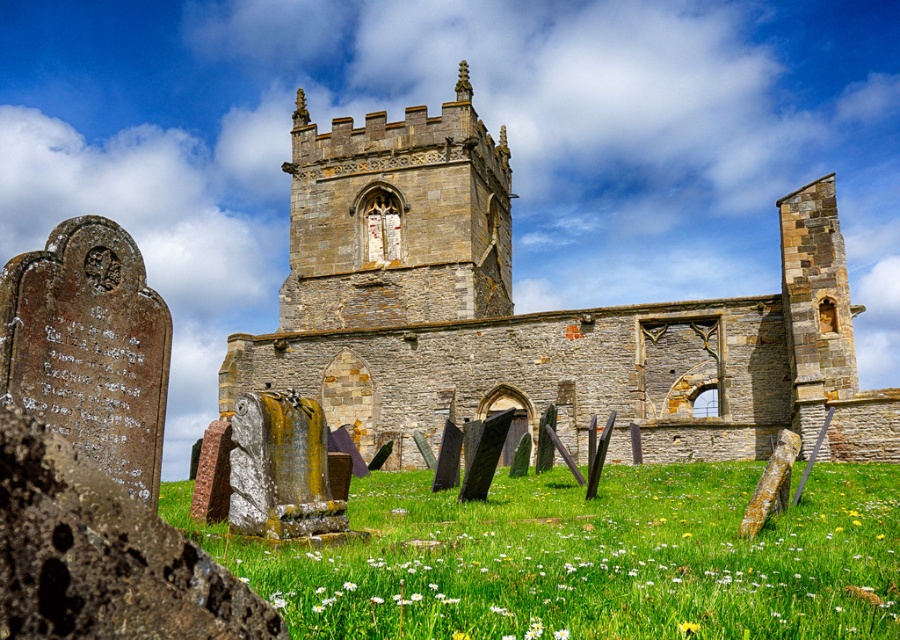
Question: Is gray stone church at center positioned behind green grassy field at lower center?

Choices:
 (A) no
 (B) yes

Answer: (B)

Question: Does gray stone church at center have a larger size compared to green grassy field at lower center?

Choices:
 (A) yes
 (B) no

Answer: (A)

Question: Which of the following is the farthest from the observer?

Choices:
 (A) (747, 452)
 (B) (315, 636)

Answer: (A)

Question: Which point is farther to the camera?

Choices:
 (A) gray stone church at center
 (B) green grassy field at lower center

Answer: (A)

Question: Can you confirm if gray stone church at center is smaller than green grassy field at lower center?

Choices:
 (A) yes
 (B) no

Answer: (B)